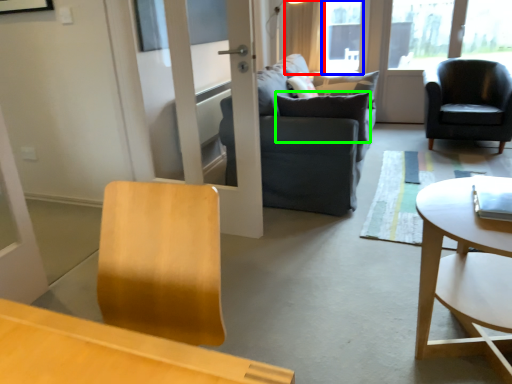
Question: Which is nearer to the curtain (highlighted by a red box)? window screen (highlighted by a blue box) or pillow (highlighted by a green box).

Choices:
 (A) window screen
 (B) pillow

Answer: (A)